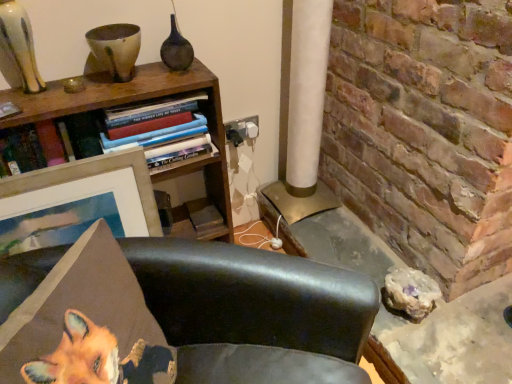
The image size is (512, 384). Find the location of `empty space that is ontop of woodenmaterial/texturebookcase at upper left (from a real-world perspective)`. empty space that is ontop of woodenmaterial/texturebookcase at upper left (from a real-world perspective) is located at coordinates point(99,91).